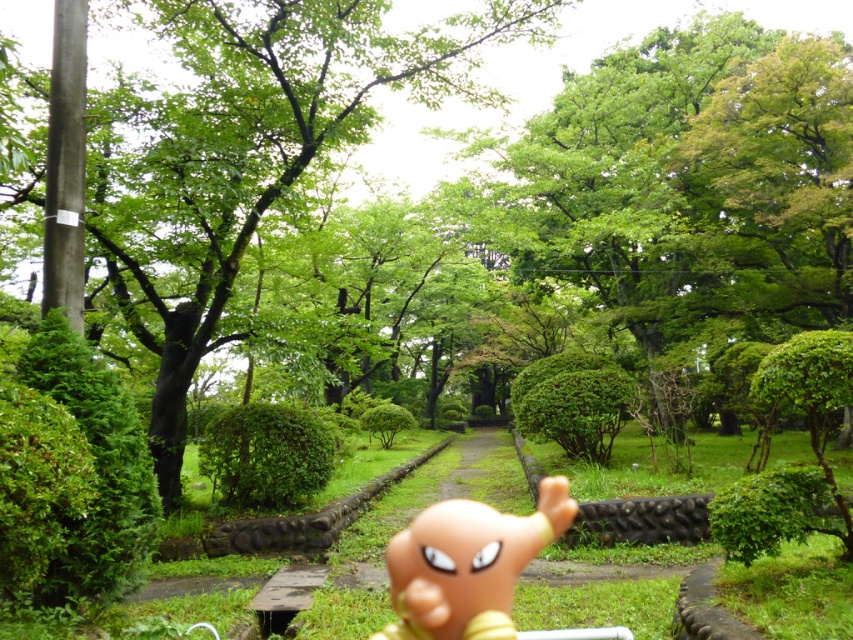
You are walking along the park pathway and see the green leafy tree at center and the matte orange toy at center. Which object is closer to you?

The green leafy tree at center is closer to you because it is positioned further to the viewer than the matte orange toy at center.

You are standing at the entrance of the park and see the small orange figurine and the green leafy tree at center. Which object is closer to the point marked at coordinates (248, 154)?

The green leafy tree at center is located at point (248, 154), so it is exactly at that coordinate. The small orange figurine is not at that point.